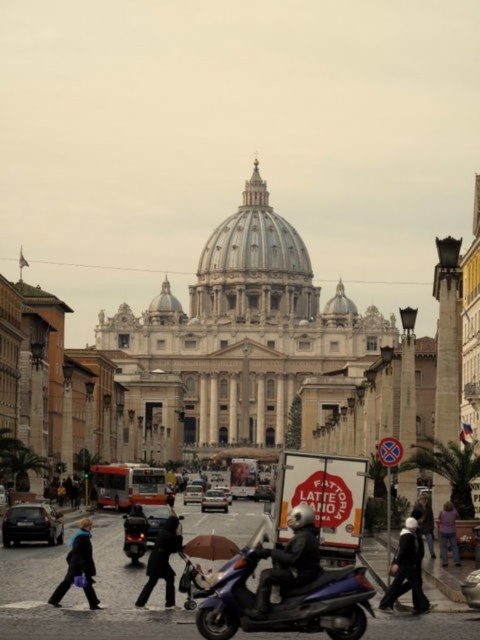
Question: Which object is positioned closest to the white matte car at center?

Choices:
 (A) dark gray jacket at lower right
 (B) black matte helmet at center
 (C) pink fabric jacket at lower right

Answer: (A)

Question: Is white marble cathedral at center to the left of dark gray fabric coat at center from the viewer's perspective?

Choices:
 (A) no
 (B) yes

Answer: (A)

Question: Does dark gray fabric coat at center have a larger size compared to pink fabric jacket at lower right?

Choices:
 (A) no
 (B) yes

Answer: (B)

Question: Which of the following is the farthest from the observer?

Choices:
 (A) (163, 531)
 (B) (316, 358)
 (C) (425, 506)
 (D) (447, 536)

Answer: (B)

Question: Does black matte helmet at center lie behind matte black car at lower left?

Choices:
 (A) yes
 (B) no

Answer: (B)

Question: Which of these objects is positioned closest to the metallic purple scooter at center?

Choices:
 (A) blue fabric jacket at lower left
 (B) pink fabric jacket at lower right

Answer: (A)